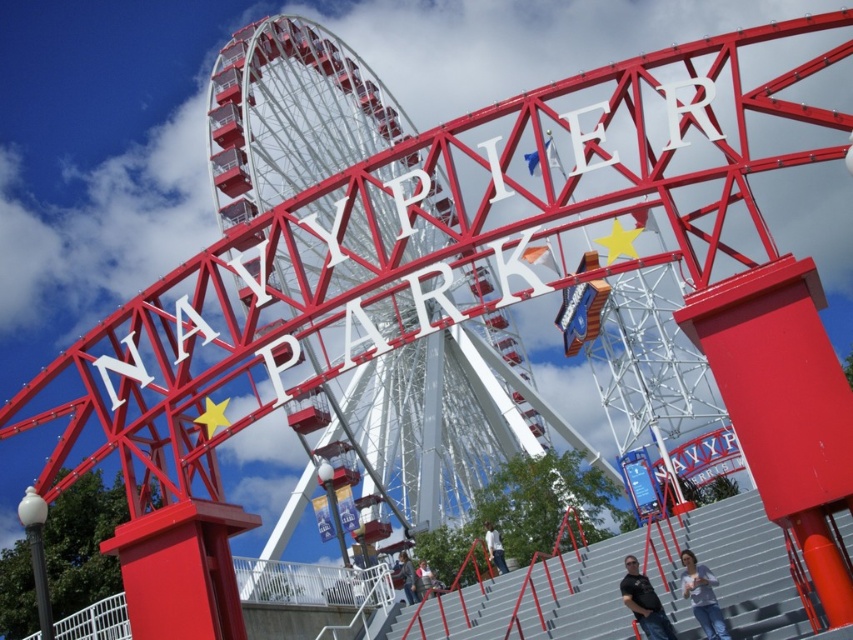
You are a photographer at Navy Pier Park and want to capture a clear shot of the Ferris wheel. You notice two items in the foreground that might obstruct your view. Which item is closer to the camera, the black matte shirt at lower center or the denim jacket at lower center?

The black matte shirt at lower center is positioned over the denim jacket at lower center, so the black matte shirt is closer to the camera.

From the picture: You are standing at the entrance of Navy Pier Park and see the denim jacket at lower center. Where exactly is the denim jacket positioned relative to the large Ferris wheel in the background?

The denim jacket at lower center is located at point (x=405, y=577), which places it near the lower part of the image, closer to the entrance archway, while the Ferris wheel is in the background, so the jacket is positioned in front of the Ferris wheel.